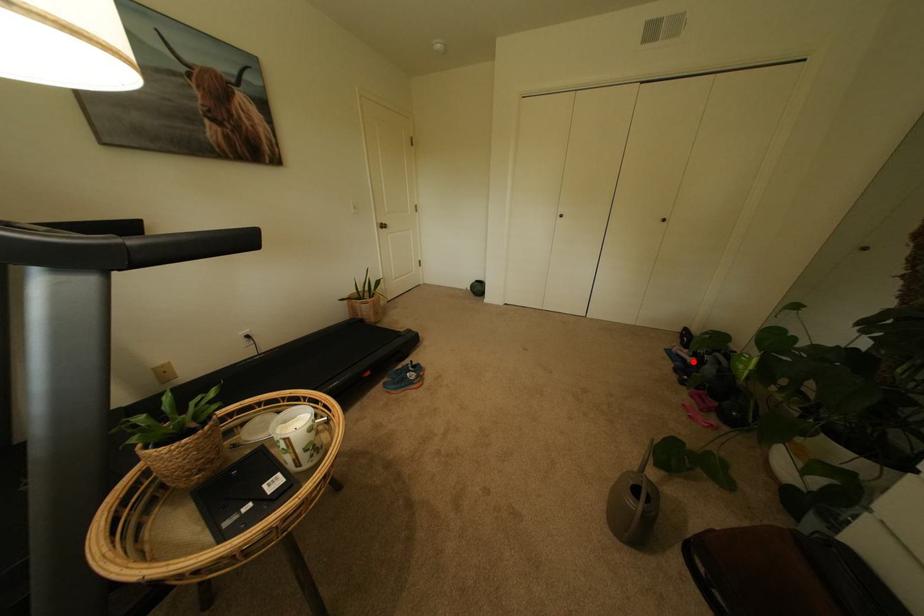
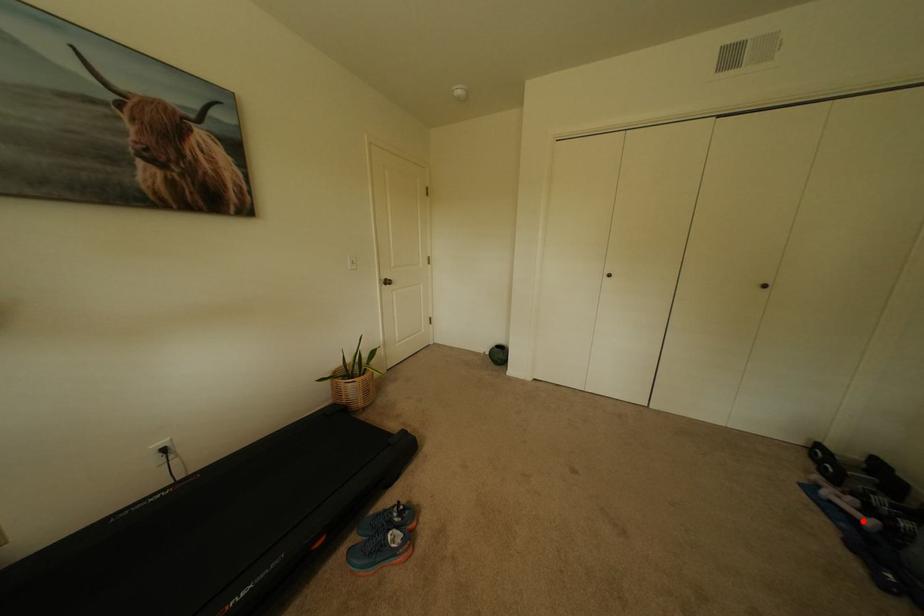
I am providing you with two images of the same scene from different viewpoints. A red point is marked on the first image and another point is marked on the second image. Is the red point in image1 aligned with the point shown in image2?

Yes